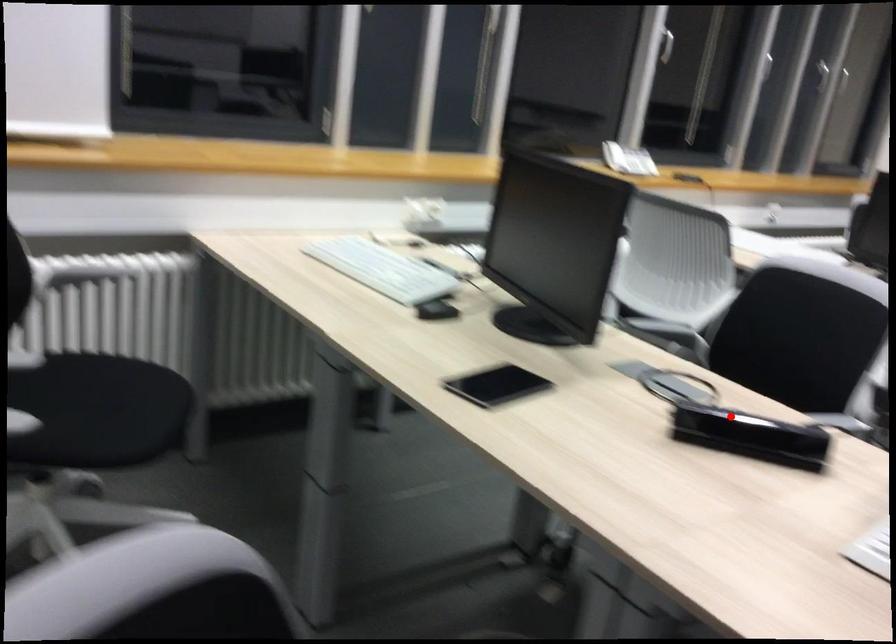
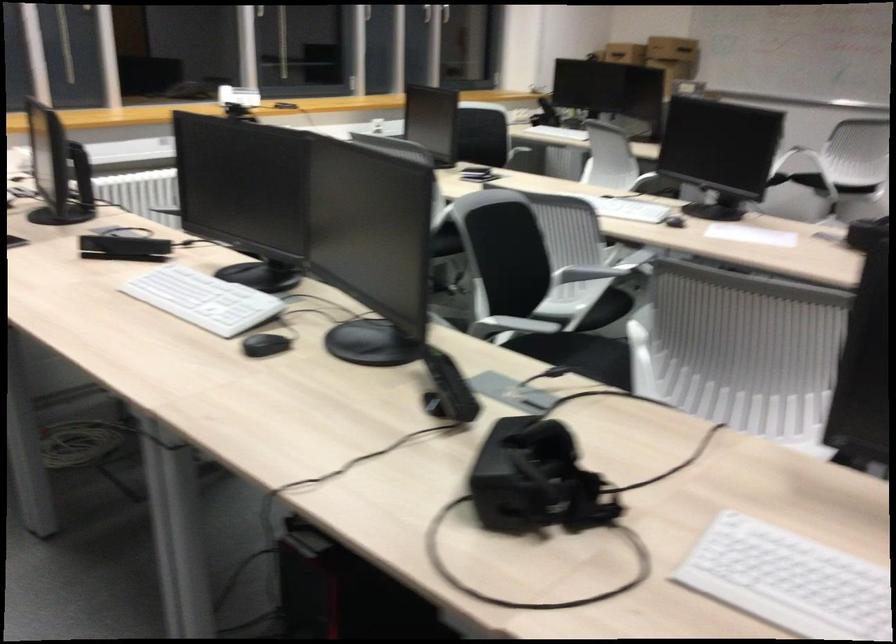
Question: I am providing you with two images of the same scene from different viewpoints. A red point is shown in image1. For the corresponding object point in image2, is it positioned nearer or farther from the camera?

Choices:
 (A) Nearer
 (B) Farther

Answer: (B)